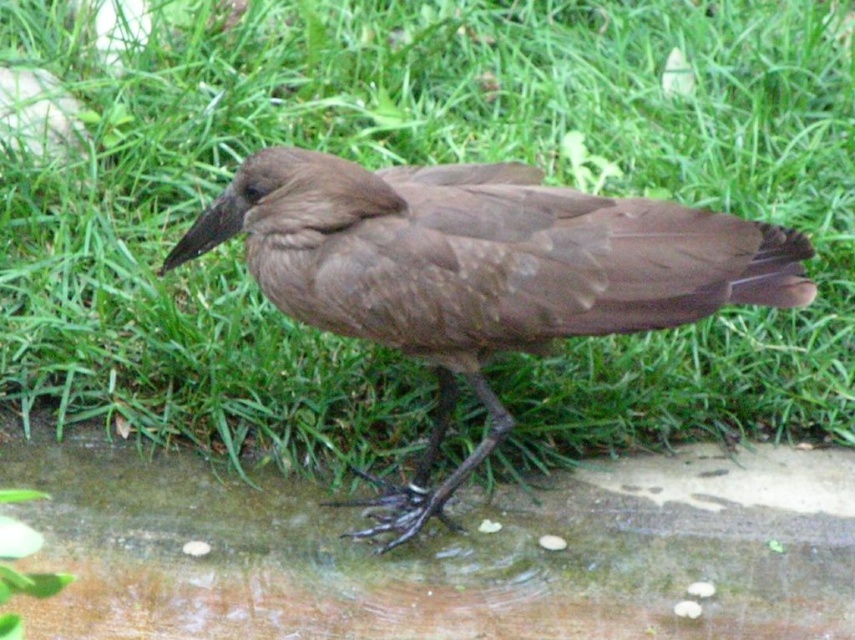
Question: Is green grass at center to the left of brown matte bird at center from the viewer's perspective?

Choices:
 (A) yes
 (B) no

Answer: (B)

Question: Which of these objects is positioned farthest from the brown matte bird at center?

Choices:
 (A) brown glossy puddle at lower center
 (B) green grass at center

Answer: (B)

Question: Can you confirm if green grass at center is positioned below brown matte bird at center?

Choices:
 (A) yes
 (B) no

Answer: (B)

Question: Which object is positioned closest to the brown matte bird at center?

Choices:
 (A) green grass at center
 (B) brown glossy puddle at lower center

Answer: (B)

Question: Does green grass at center appear over brown matte bird at center?

Choices:
 (A) no
 (B) yes

Answer: (B)

Question: Which object is closer to the camera taking this photo?

Choices:
 (A) brown matte bird at center
 (B) green grass at center
 (C) brown glossy puddle at lower center

Answer: (A)